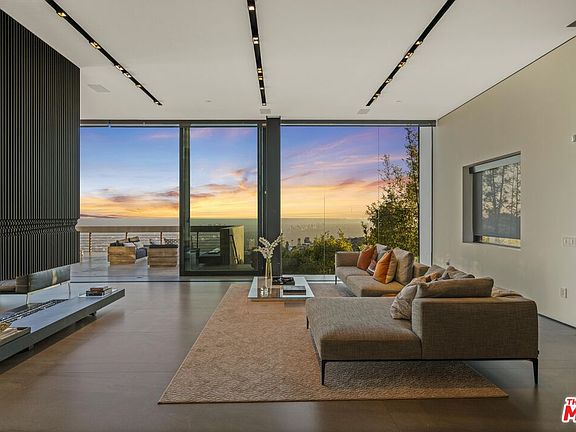
This screenshot has height=432, width=576. Find the location of `large windows`. large windows is located at coordinates (117, 179), (214, 178), (341, 168).